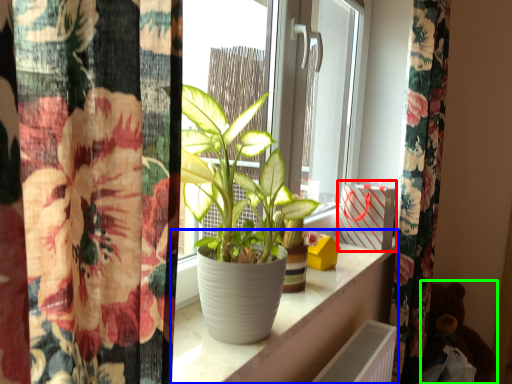
Question: Estimate the real-world distances between objects in this image. Which object is closer to window box (highlighted by a red box), window sill (highlighted by a blue box) or toy (highlighted by a green box)?

Choices:
 (A) window sill
 (B) toy

Answer: (A)